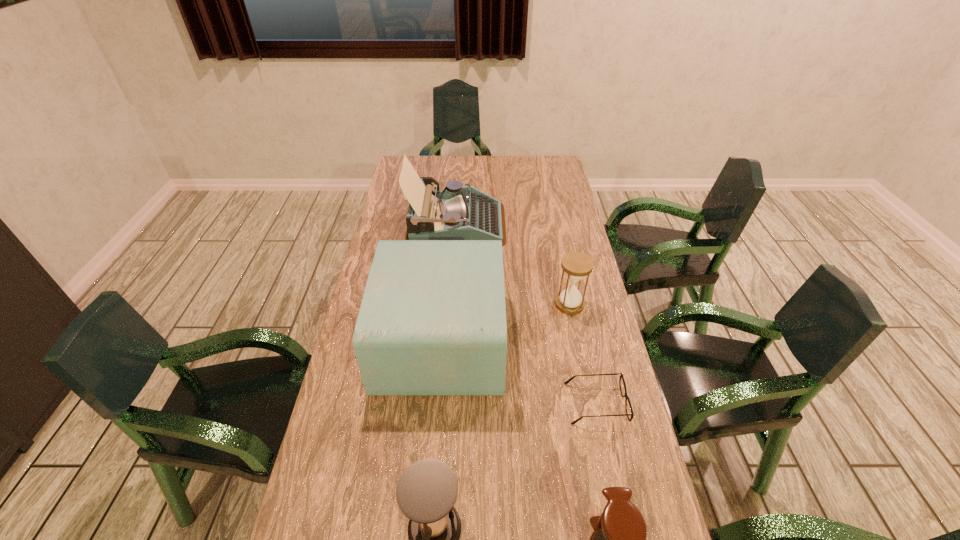
This screenshot has height=540, width=960. I want to click on typewriter located in the left edge section of the desktop, so click(x=456, y=213).

Locate an element on the screen. The width and height of the screenshot is (960, 540). radio receiver present at the left edge is located at coordinates (432, 322).

This screenshot has width=960, height=540. I want to click on hourglass that is at the right edge, so click(576, 265).

At what (x,y) coordinates should I click in order to perform the action: click on spectacles at the right edge. Please return your answer as a coordinate pair (x, y). The height and width of the screenshot is (540, 960). Looking at the image, I should click on (631, 414).

Image resolution: width=960 pixels, height=540 pixels. Find the location of `vacant region at the far edge of the desktop`. vacant region at the far edge of the desktop is located at coordinates (455, 175).

In order to click on free space at the left edge of the desktop in this screenshot , I will do `click(352, 376)`.

The height and width of the screenshot is (540, 960). In the image, there is a desktop. Identify the location of vacant space at the right edge. (579, 228).

The image size is (960, 540). In order to click on free space at the far right corner in this screenshot , I will do `click(562, 171)`.

The image size is (960, 540). I want to click on vacant point located between the farthest object and the farthest hourglass, so click(513, 264).

The image size is (960, 540). Identify the location of free spot between the farthest object and the shortest object. (526, 314).